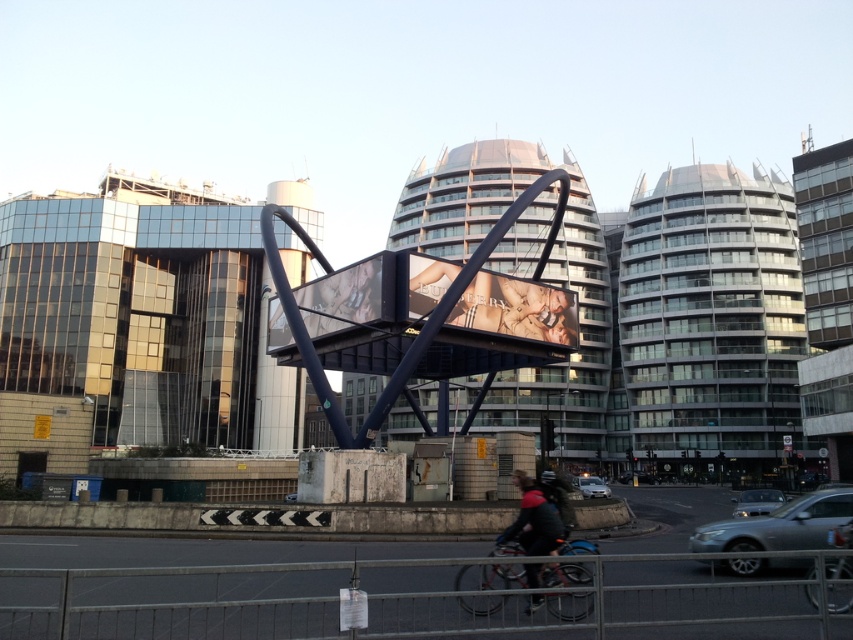
Does point (550, 314) come behind point (753, 509)?

Yes.

Where is `matte silver billboard at center`? This screenshot has height=640, width=853. matte silver billboard at center is located at coordinates (517, 308).

The image size is (853, 640). I want to click on shiny metallic bicycle at lower center, so click(x=491, y=577).

Who is more distant from viewer, (589,598) or (624,481)?

The point (624,481) is more distant.

This screenshot has height=640, width=853. What do you see at coordinates (491, 577) in the screenshot?
I see `shiny metallic bicycle at lower center` at bounding box center [491, 577].

Locate an element on the screen. Image resolution: width=853 pixels, height=640 pixels. shiny metallic bicycle at lower center is located at coordinates (491, 577).

Which is behind, point (701, 538) or point (762, 500)?

The point (762, 500) is behind.

Measure the distance between silver metallic sedan at lower right and silver metallic car at center.

silver metallic sedan at lower right is 11.94 meters from silver metallic car at center.

The image size is (853, 640). What do you see at coordinates (779, 525) in the screenshot? I see `silver metallic sedan at lower right` at bounding box center [779, 525].

Identify the location of silver metallic sedan at lower right. pos(779,525).